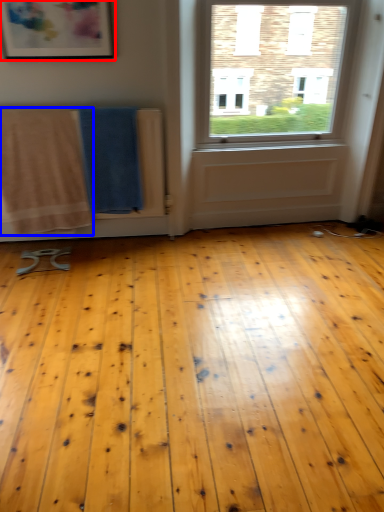
Question: Which of the following is the farthest to the observer, picture frame (highlighted by a red box) or beach towel (highlighted by a blue box)?

Choices:
 (A) picture frame
 (B) beach towel

Answer: (B)